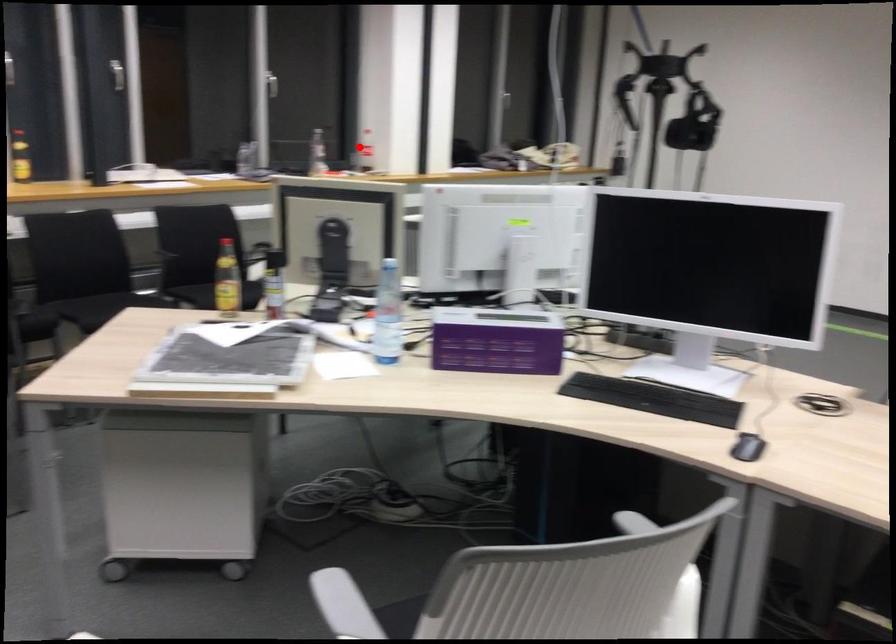
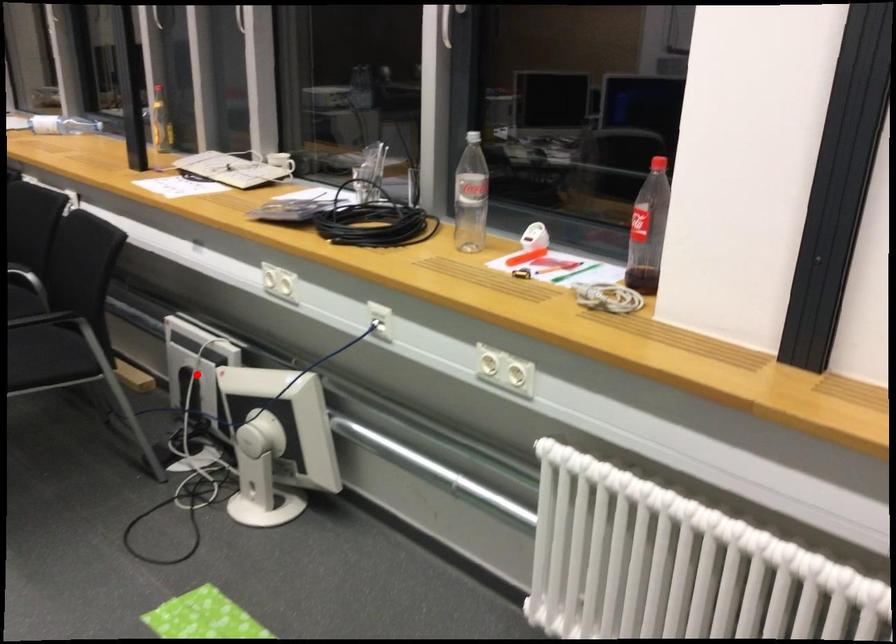
I am providing you with two images of the same scene from different viewpoints. A red point is marked on the first image and another point is marked on the second image. Are the points marked in image1 and image2 representing the same 3D position?

No